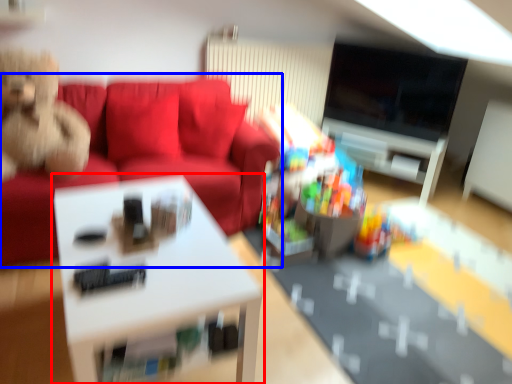
Question: Which object is closer to the camera taking this photo, table (highlighted by a red box) or studio couch (highlighted by a blue box)?

Choices:
 (A) table
 (B) studio couch

Answer: (A)